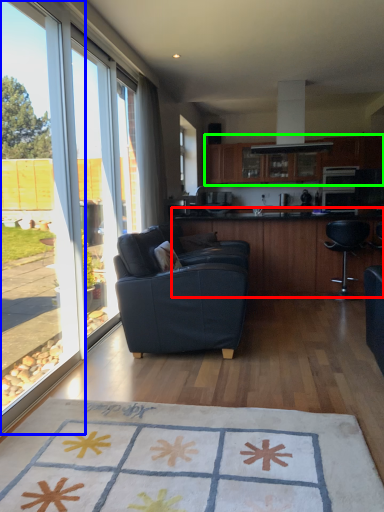
Question: Which is nearer to the table (highlighted by a red box)? window (highlighted by a blue box) or cabinetry (highlighted by a green box).

Choices:
 (A) window
 (B) cabinetry

Answer: (B)